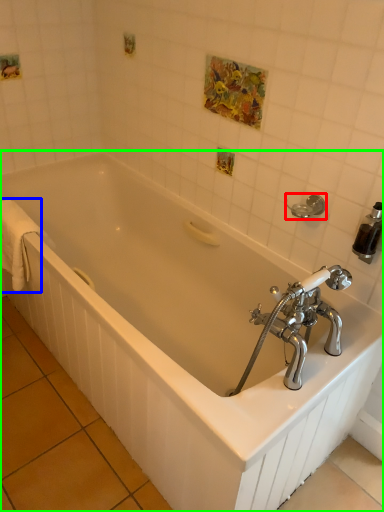
Question: Considering the real-world distances, which object is closest to towel bar (highlighted by a red box)? bath towel (highlighted by a blue box) or bathtub (highlighted by a green box).

Choices:
 (A) bath towel
 (B) bathtub

Answer: (B)